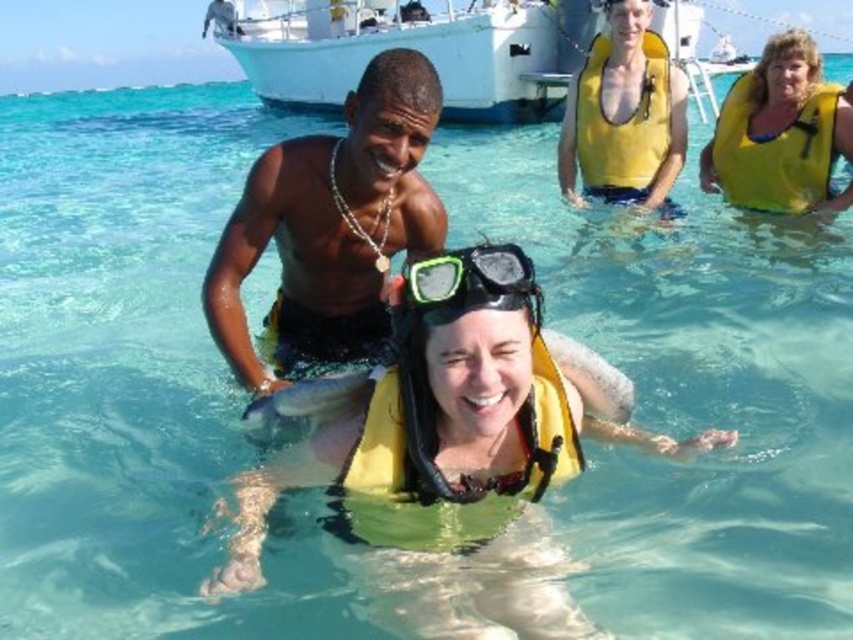
Question: Is matte black snorkel gear at center wider than yellow life vest at upper right?

Choices:
 (A) yes
 (B) no

Answer: (B)

Question: Which object is the farthest from the white plastic boat at upper center?

Choices:
 (A) matte black snorkel gear at center
 (B) yellow life vest at upper center
 (C) yellow life vest at upper right

Answer: (A)

Question: Which point is farther to the camera?

Choices:
 (A) matte black snorkel gear at center
 (B) shiny silver fish at center
 (C) yellow life vest at upper right
 (D) yellow foam life jacket at center

Answer: (C)

Question: Which of the following is the closest to the observer?

Choices:
 (A) (312, 358)
 (B) (273, 428)

Answer: (B)

Question: Is yellow life vest at upper center above shiny silver fish at center?

Choices:
 (A) no
 (B) yes

Answer: (B)

Question: Can you confirm if yellow foam life jacket at center is positioned above green matte snorkel mask at center?

Choices:
 (A) no
 (B) yes

Answer: (A)